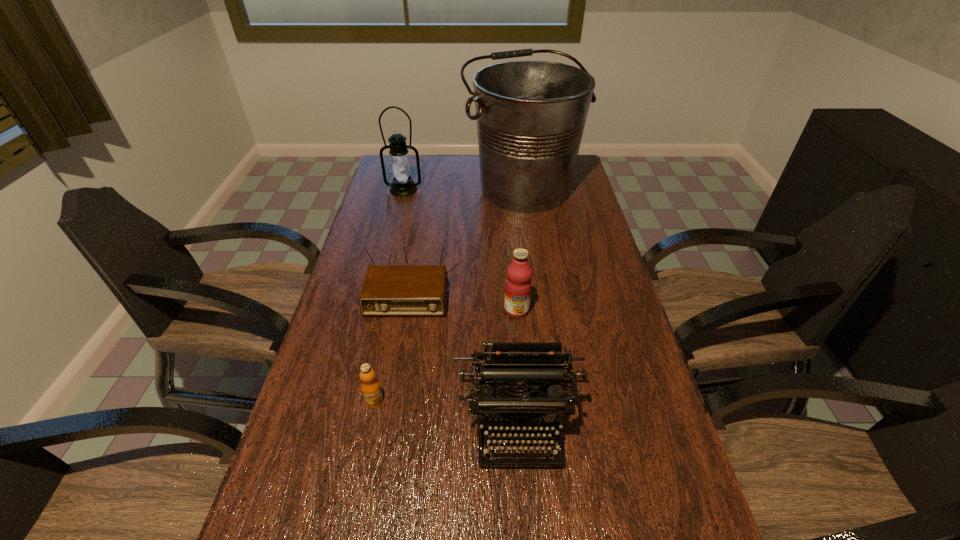
Where is `the tallest object`? The image size is (960, 540). the tallest object is located at coordinates (531, 114).

Locate an element on the screen. This screenshot has height=540, width=960. the second tallest object is located at coordinates (403, 185).

At what (x,y) coordinates should I click in order to perform the action: click on radio_receiver. Please return your answer as a coordinate pair (x, y). This screenshot has height=540, width=960. Looking at the image, I should click on (388, 290).

What are the coordinates of `fruit juice` in the screenshot? It's located at (518, 285).

Locate an element on the screen. This screenshot has width=960, height=540. typewriter is located at coordinates (505, 363).

This screenshot has height=540, width=960. I want to click on orange juice, so click(370, 386).

The width and height of the screenshot is (960, 540). What are the coordinates of `vacant space situated on the front of the tallest object` in the screenshot? It's located at (537, 287).

Find the location of `vacant space located on the side where the second tallest object emits light`. vacant space located on the side where the second tallest object emits light is located at coordinates (397, 213).

At what (x,y) coordinates should I click in order to perform the action: click on free space located 0.330m on the front panel of the radio_receiver. Please return your answer as a coordinate pair (x, y). The height and width of the screenshot is (540, 960). Looking at the image, I should click on (381, 429).

The width and height of the screenshot is (960, 540). In order to click on blank space located 0.400m on the label of the fruit juice in this screenshot , I will do `click(529, 461)`.